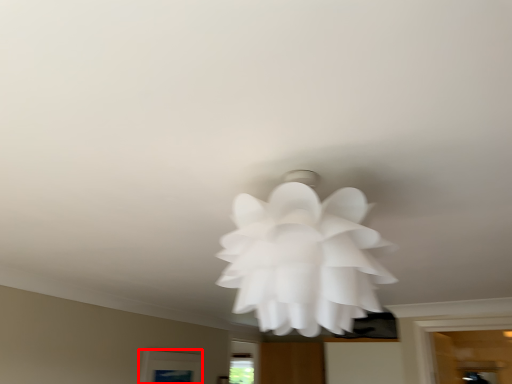
Question: From the image's perspective, what is the correct spatial positioning of window (annotated by the red box) in reference to flower?

Choices:
 (A) below
 (B) above

Answer: (A)